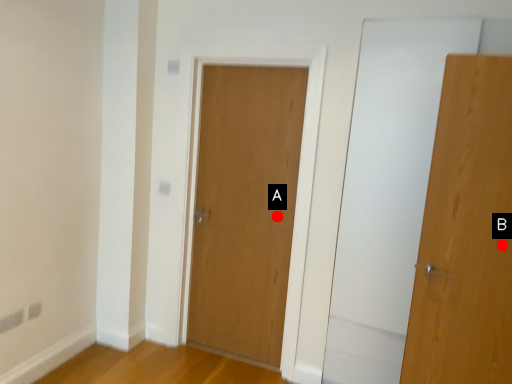
Question: Two points are circled on the image, labeled by A and B beside each circle. Which point appears closest to the camera in this image?

Choices:
 (A) A is closer
 (B) B is closer

Answer: (B)